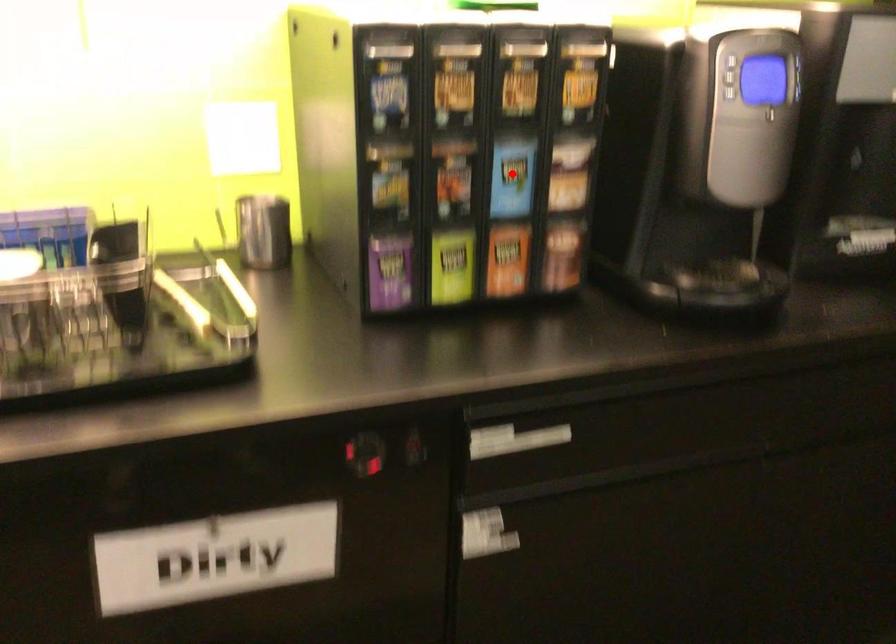
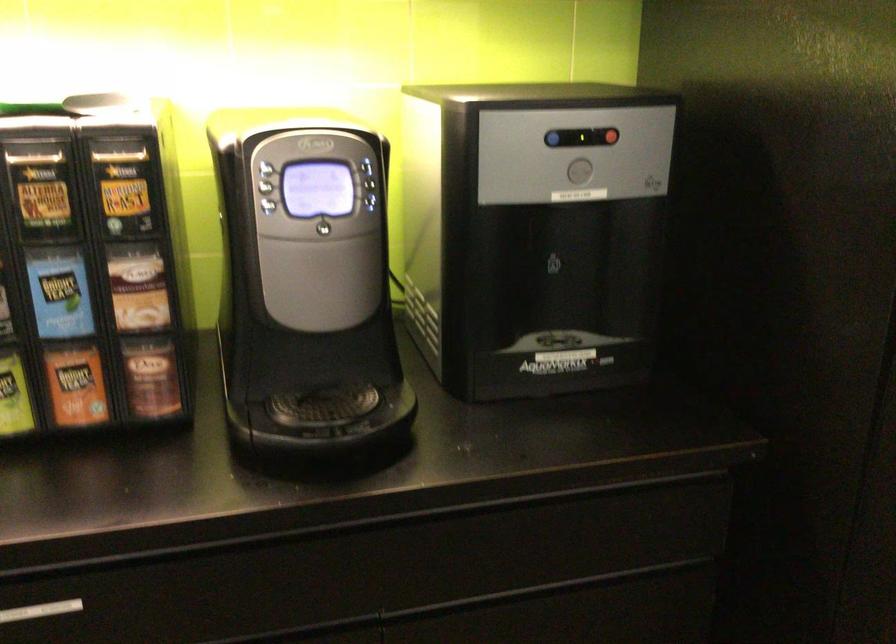
The point at the highlighted location is marked in the first image. Where is the corresponding point in the second image?

(58, 292)